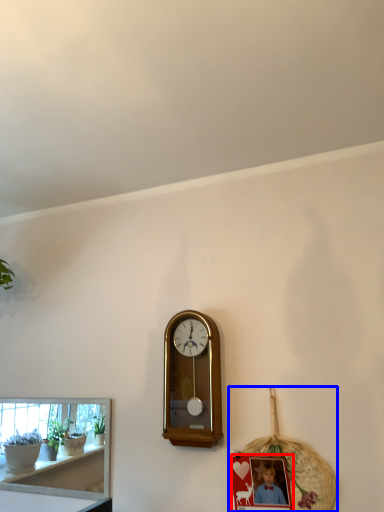
Question: Which point is further to the camera, picture frame (highlighted by a red box) or basket (highlighted by a blue box)?

Choices:
 (A) picture frame
 (B) basket

Answer: (B)